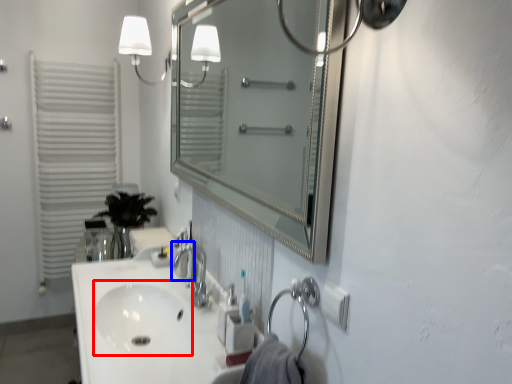
Question: Which object is closer to the camera taking this photo, sink (highlighted by a red box) or faucet (highlighted by a blue box)?

Choices:
 (A) sink
 (B) faucet

Answer: (A)